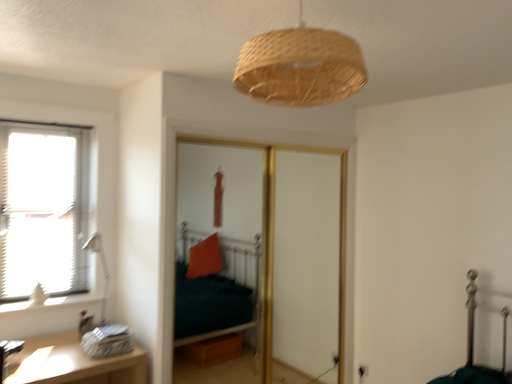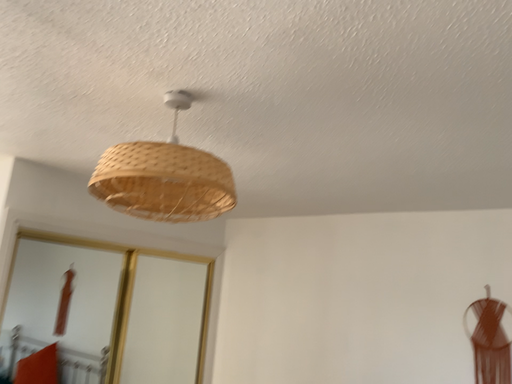
Question: Which way did the camera rotate in the video?

Choices:
 (A) rotated downward
 (B) rotated upward

Answer: (B)